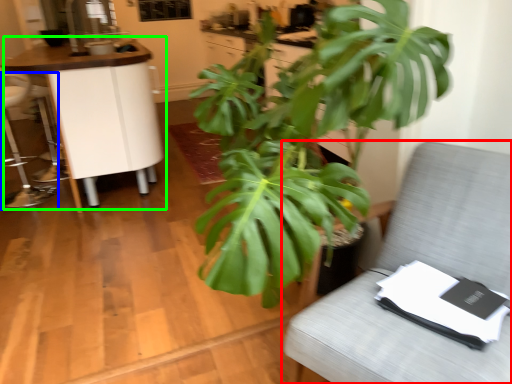
Question: Which object is positioned closest to furniture (highlighted by a red box)? Select from swivel chair (highlighted by a blue box) and table (highlighted by a green box).

Choices:
 (A) swivel chair
 (B) table

Answer: (B)